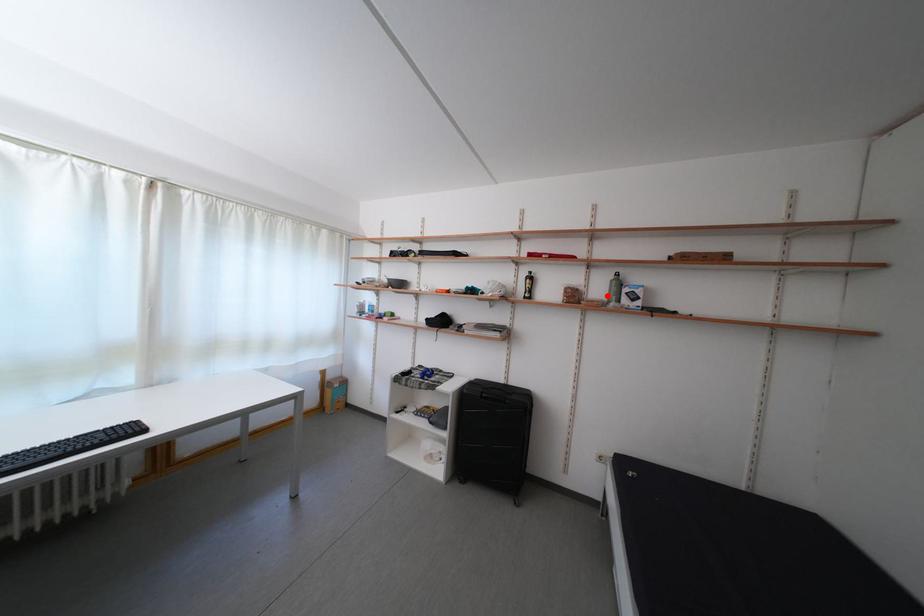
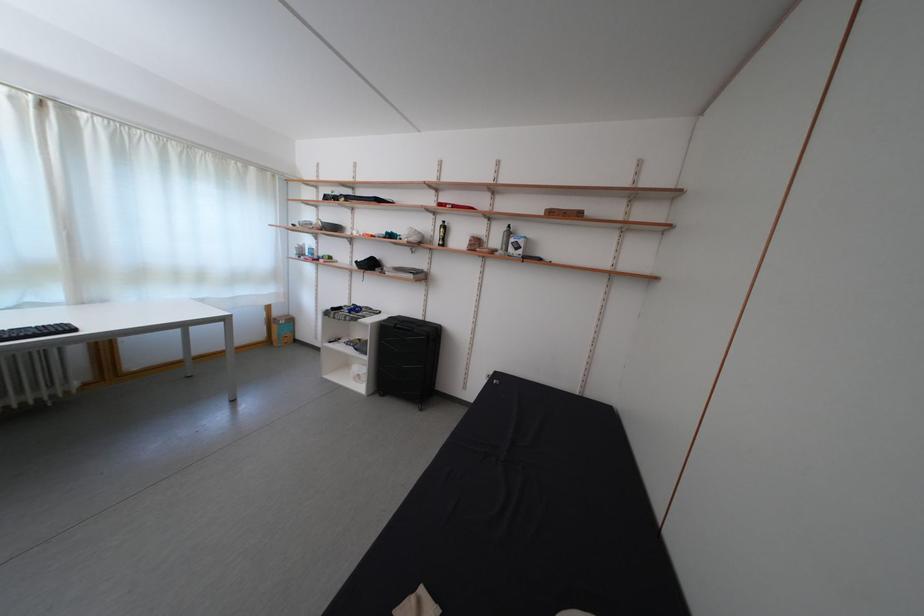
The point at the highlighted location is marked in the first image. Where is the corresponding point in the second image?

(505, 246)